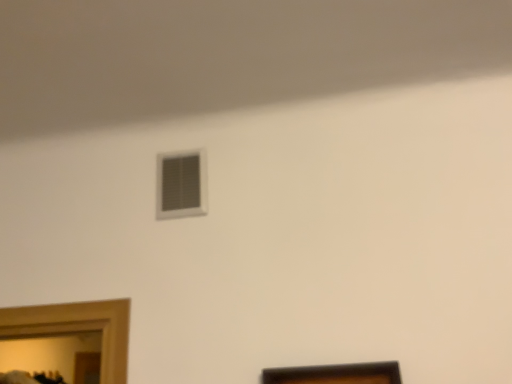
Question: From the image's perspective, is white plastic vent at upper center above or below brown wooden picture frame at lower center?

Choices:
 (A) above
 (B) below

Answer: (A)

Question: Is white plastic vent at upper center spatially inside brown wooden picture frame at lower center, or outside of it?

Choices:
 (A) outside
 (B) inside

Answer: (A)

Question: Based on their positions, is white plastic vent at upper center located to the left or right of brown wooden picture frame at lower center?

Choices:
 (A) right
 (B) left

Answer: (B)

Question: Considering their positions, is brown wooden picture frame at lower center located in front of or behind white plastic vent at upper center?

Choices:
 (A) behind
 (B) front

Answer: (B)

Question: Based on their sizes in the image, would you say brown wooden picture frame at lower center is bigger or smaller than white plastic vent at upper center?

Choices:
 (A) big
 (B) small

Answer: (A)

Question: From a real-world perspective, is brown wooden picture frame at lower center positioned above or below white plastic vent at upper center?

Choices:
 (A) below
 (B) above

Answer: (A)

Question: In terms of height, does brown wooden picture frame at lower center look taller or shorter compared to white plastic vent at upper center?

Choices:
 (A) tall
 (B) short

Answer: (A)